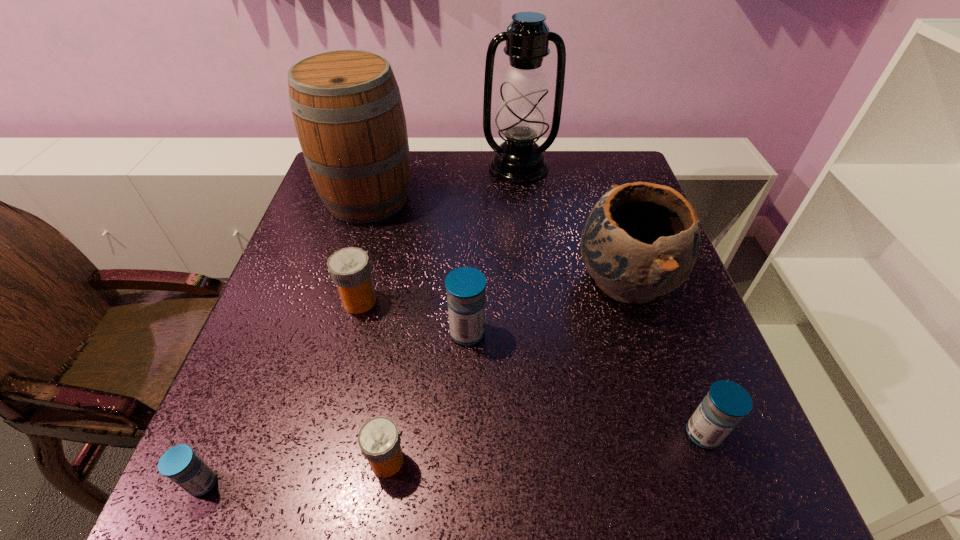
Identify the location of oil lamp. Image resolution: width=960 pixels, height=540 pixels. (522, 116).

Where is `cider`? This screenshot has width=960, height=540. cider is located at coordinates (348, 113).

The width and height of the screenshot is (960, 540). I want to click on pottery, so click(641, 240).

This screenshot has width=960, height=540. In order to click on blue pottery in this screenshot , I will do [641, 240].

What are the coordinates of `the fifth shortest object` in the screenshot? It's located at (465, 286).

Locate an element on the screen. This screenshot has height=540, width=960. the tallest medicine is located at coordinates (465, 286).

At what (x,y) coordinates should I click in order to perform the action: click on the second medicine from left to right. Please return your answer as a coordinate pair (x, y). The height and width of the screenshot is (540, 960). Looking at the image, I should click on (350, 269).

The width and height of the screenshot is (960, 540). Find the location of `the farthest medicine`. the farthest medicine is located at coordinates (350, 269).

Find the location of `the rightmost medicine`. the rightmost medicine is located at coordinates (726, 403).

Identify the location of the second smallest blue medicine. The width and height of the screenshot is (960, 540). (726, 403).